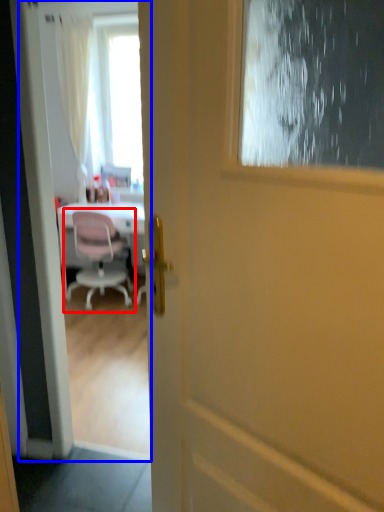
Question: Among these objects, which one is nearest to the camera, chair (highlighted by a red box) or screen door (highlighted by a blue box)?

Choices:
 (A) chair
 (B) screen door

Answer: (B)